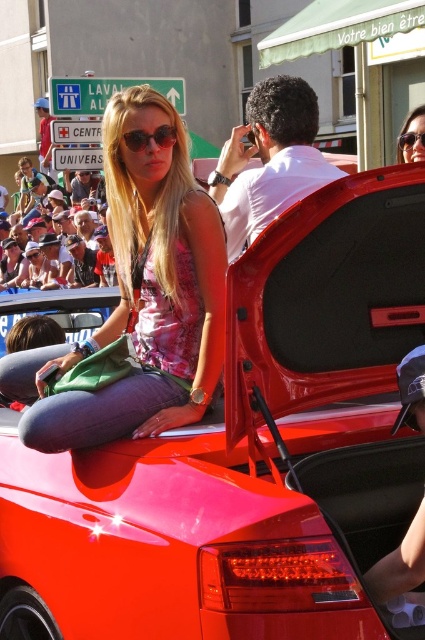
Question: Which of the following is the farthest from the observer?

Choices:
 (A) white matte shirt at center
 (B) matte black sunglasses at upper center

Answer: (B)

Question: Is the position of matte pink dress at center more distant than that of matte black sunglasses at center?

Choices:
 (A) no
 (B) yes

Answer: (B)

Question: Is the position of matte black sunglasses at center less distant than that of matte black camera at upper left?

Choices:
 (A) yes
 (B) no

Answer: (A)

Question: Which of the following is the closest to the observer?

Choices:
 (A) white matte shirt at center
 (B) pink fabric dress at center
 (C) matte black sunglasses at center
 (D) matte black camera at upper left

Answer: (B)

Question: Is white matte shirt at center below matte black sunglasses at center?

Choices:
 (A) no
 (B) yes

Answer: (B)

Question: Which point is closer to the camera taking this photo?

Choices:
 (A) (309, 112)
 (B) (129, 144)
 (C) (87, 280)

Answer: (B)